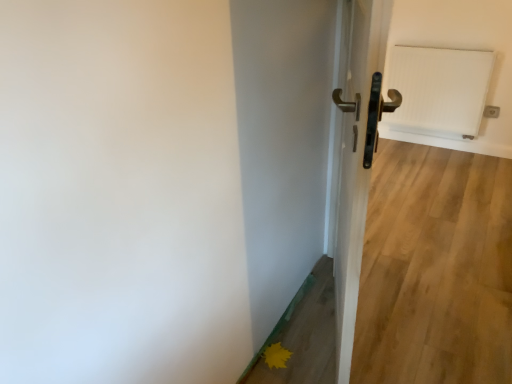
The width and height of the screenshot is (512, 384). Identify the location of vacant region to the left of metallic gold door handle at center. (294, 334).